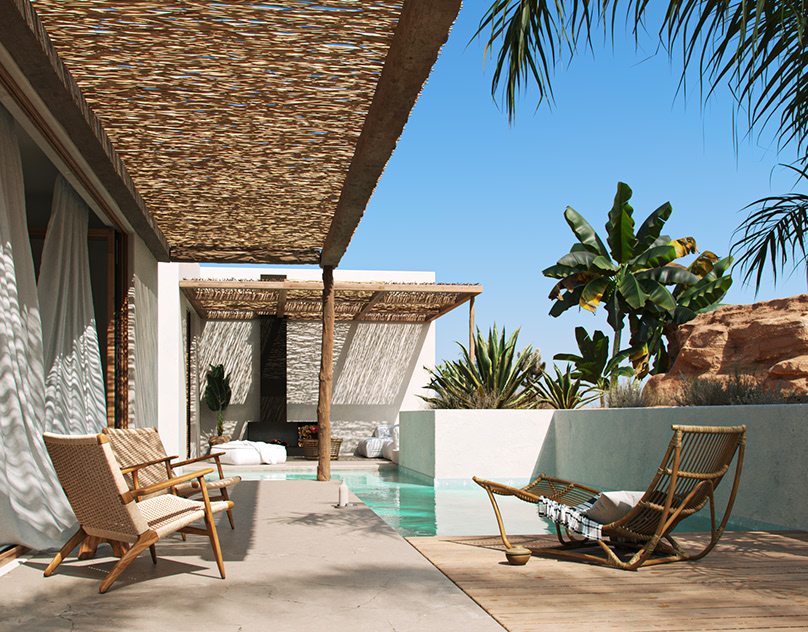
Find any where to pick up the towel on that right sided chair in the image. Your answer should be formatted as a list of tuples, i.e. [(x1, y1), (x2, y2), ...], where each tuple contains the x and y coordinates of a point satisfying the conditions above.

[(587, 531)]